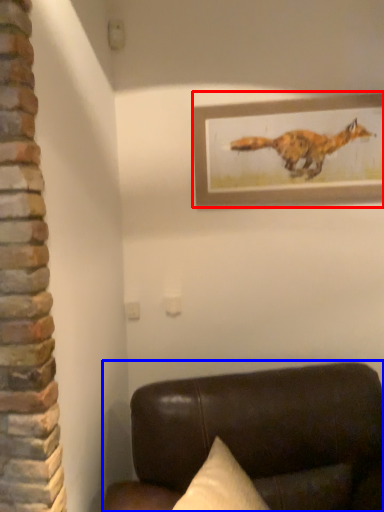
Question: Which object appears farthest to the camera in this image, picture frame (highlighted by a red box) or furniture (highlighted by a blue box)?

Choices:
 (A) picture frame
 (B) furniture

Answer: (A)